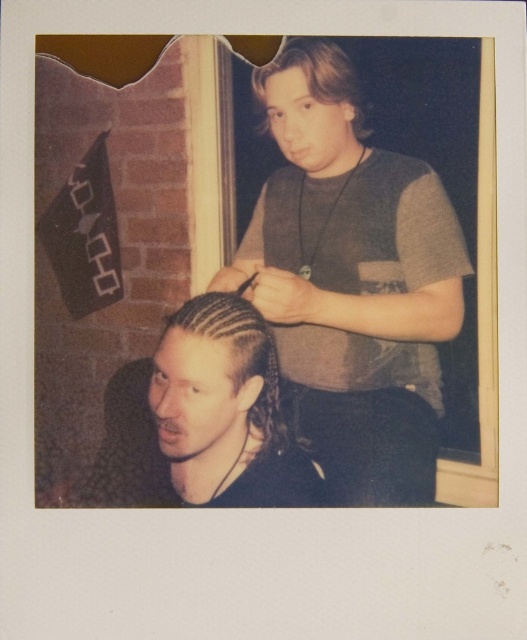
Does black braided hair at center have a lesser width compared to light brown wavy hair at upper center?

Incorrect, black braided hair at center's width is not less than light brown wavy hair at upper center's.

Measure the distance between black braided hair at center and camera.

A distance of 1.21 meters exists between black braided hair at center and camera.

Who is more distant from viewer, (258, 400) or (324, 40)?

The point (258, 400) is behind.

Locate an element on the screen. The image size is (527, 640). black braided hair at center is located at coordinates (239, 358).

Between gray fabric shirt at upper center and black braided hair at center, which one appears on the right side from the viewer's perspective?

From the viewer's perspective, gray fabric shirt at upper center appears more on the right side.

Does gray fabric shirt at upper center have a lesser height compared to black braided hair at center?

Incorrect, gray fabric shirt at upper center's height does not fall short of black braided hair at center's.

Is point (314, 106) farther from camera compared to point (229, 412)?

Yes, it is.

I want to click on gray fabric shirt at upper center, so click(x=353, y=280).

Does gray fabric shirt at upper center have a lesser width compared to light brown wavy hair at upper center?

Incorrect, gray fabric shirt at upper center's width is not less than light brown wavy hair at upper center's.

Who is lower down, gray fabric shirt at upper center or light brown wavy hair at upper center?

gray fabric shirt at upper center is below.

The width and height of the screenshot is (527, 640). I want to click on gray fabric shirt at upper center, so click(353, 280).